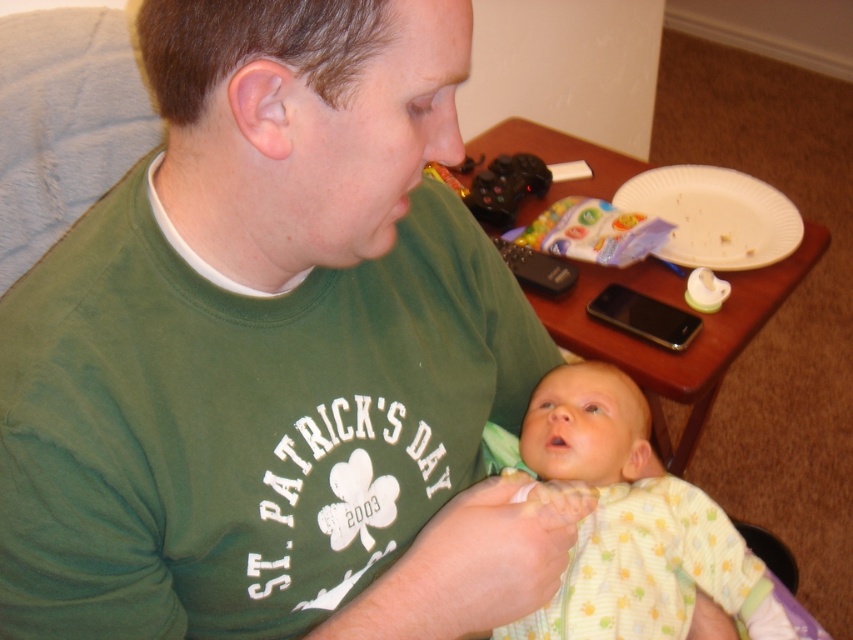
You are organizing a small snack area for a baby. You have a white paper plate at upper right and a black matte game controller at upper center. Which object should you move to make space for the baby food?

You should move the black matte game controller at upper center because the white paper plate at upper right is larger and likely occupies more space, making it less ideal to move for accommodating the baby food.

You are a photographer standing at a distance. You want to take a closeup photo of the light yellow knit onesie at center. The camera requires the subject to be within 24 inches for optimal focus. Can you take the photo without moving closer?

The light yellow knit onesie at center is 25.90 inches away from the camera, which is beyond the 24 inches required for optimal focus. Therefore, you cannot take the photo without moving closer.

You are organizing a snack and game area for a child. You have a white paper plate at upper right and a black matte game controller at upper center. Which item has a larger width?

The white paper plate at upper right has a larger width than the black matte game controller at upper center.